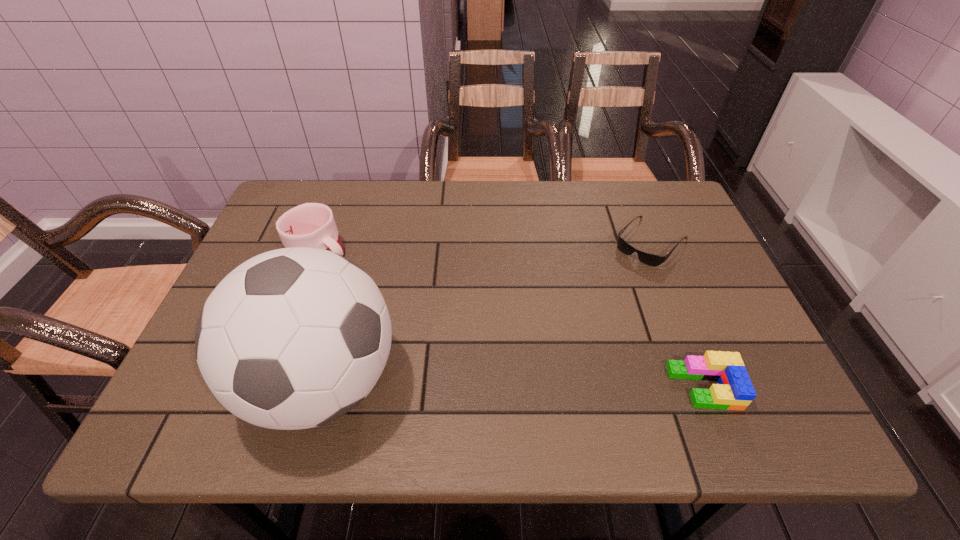
Locate an element on the screen. The width and height of the screenshot is (960, 540). the tallest object is located at coordinates (294, 338).

Where is `the third tallest object`? The image size is (960, 540). the third tallest object is located at coordinates (734, 391).

At what (x,y) coordinates should I click in order to perform the action: click on the shortest object. Please return your answer as a coordinate pair (x, y). The height and width of the screenshot is (540, 960). Looking at the image, I should click on (649, 259).

The width and height of the screenshot is (960, 540). What are the coordinates of `the second tallest object` in the screenshot? It's located at (312, 225).

Identify the location of vacant space positioned 0.290m on the back of the tallest object. point(364,238).

Where is `vacant space situated on the back of the second shortest object`? vacant space situated on the back of the second shortest object is located at coordinates (678, 320).

Locate an element on the screen. Image resolution: width=960 pixels, height=540 pixels. vacant space located 0.280m on the front-facing side of the shortest object is located at coordinates (572, 326).

What are the coordinates of `vacant space located 0.190m on the front-facing side of the shortest object` in the screenshot? It's located at (593, 303).

Where is `vacant area situated 0.280m on the front-facing side of the shortest object`? The width and height of the screenshot is (960, 540). vacant area situated 0.280m on the front-facing side of the shortest object is located at coordinates (572, 326).

Locate an element on the screen. The width and height of the screenshot is (960, 540). free spot located on the side with the handle of the mug is located at coordinates (427, 334).